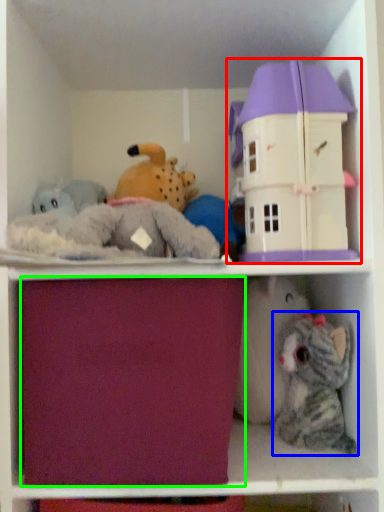
Question: Which object is positioned closest to toy (highlighted by a red box)? Select from toy (highlighted by a blue box) and drawer (highlighted by a green box).

Choices:
 (A) toy
 (B) drawer

Answer: (B)